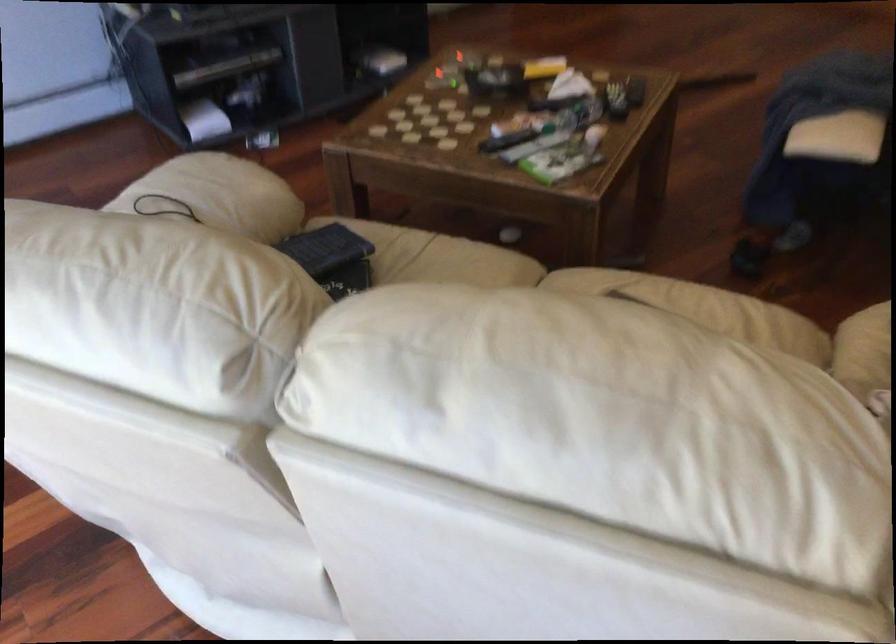
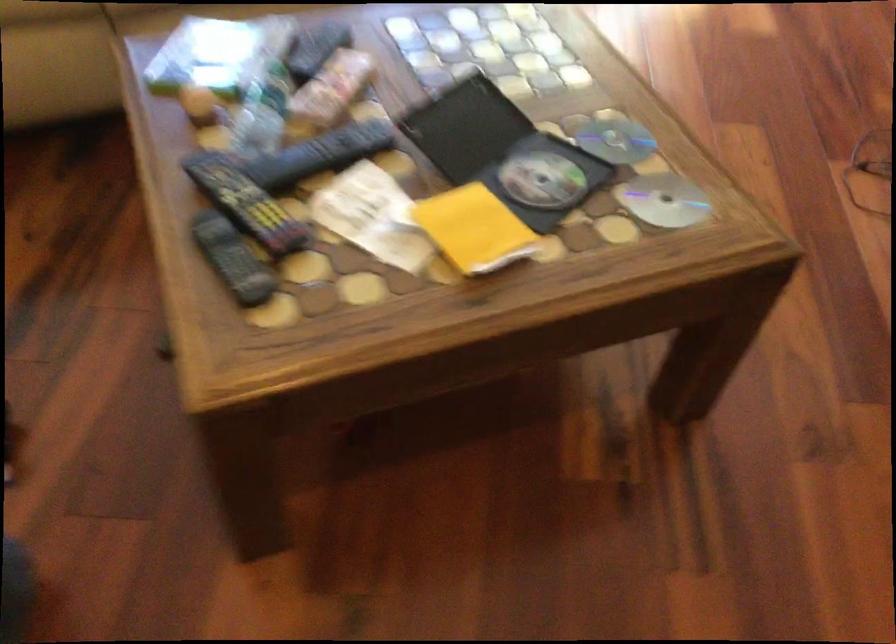
The point at (636,84) is marked in the first image. Where is the corresponding point in the second image?

(233, 259)